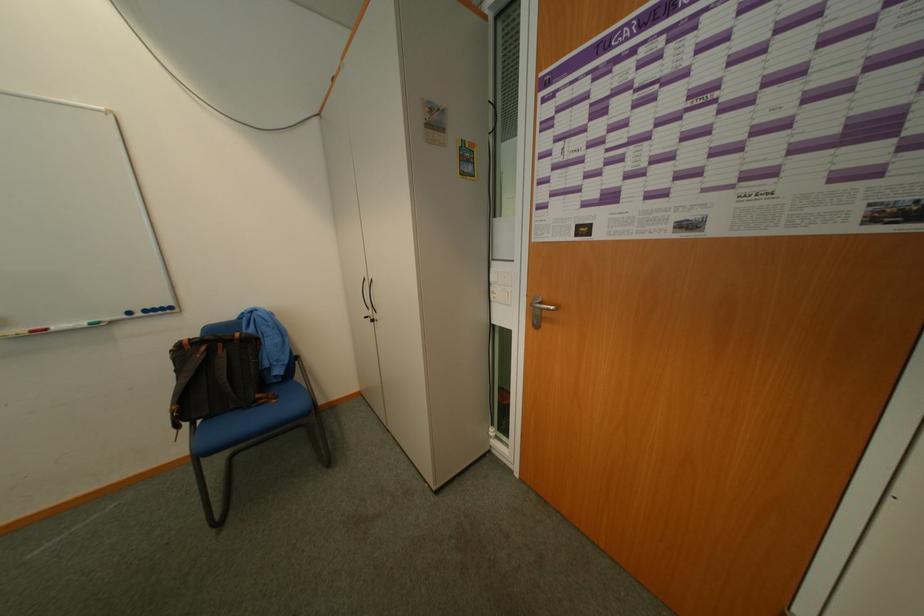
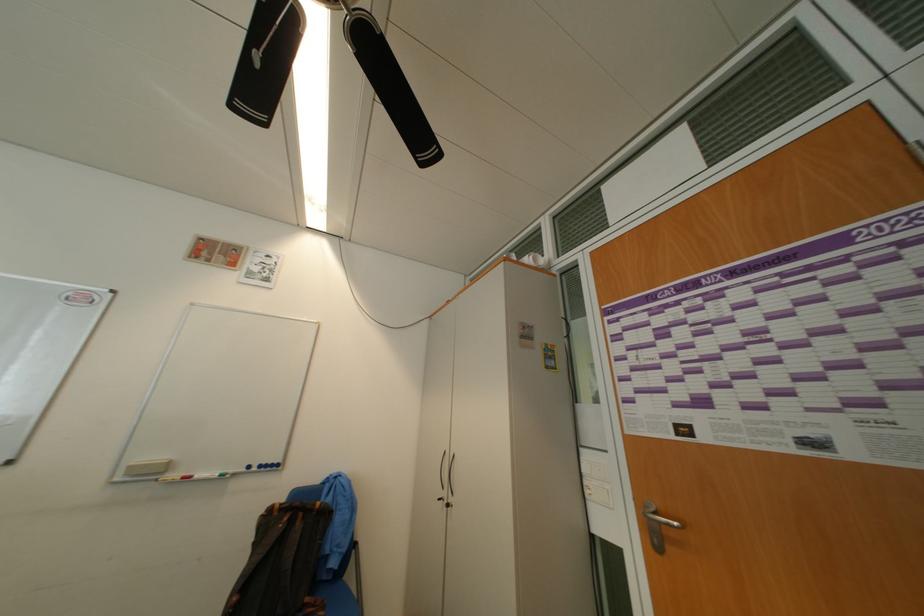
Where in the second image is the point corresponding to [286,399] from the first image?

(334, 609)